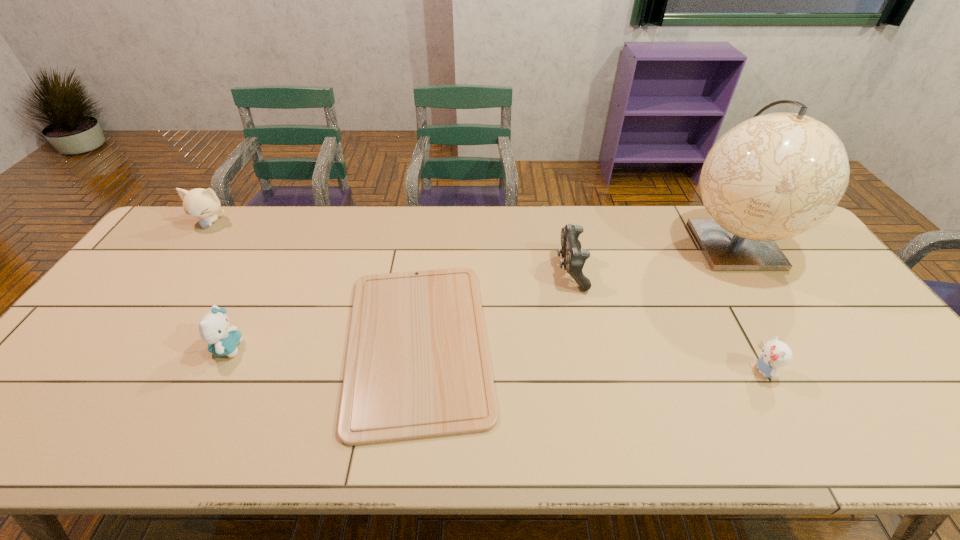
The width and height of the screenshot is (960, 540). Find the location of `kitten located at the far edge`. kitten located at the far edge is located at coordinates (200, 203).

Locate an element on the screen. control at the far edge is located at coordinates (574, 257).

Locate an element on the screen. Image resolution: width=960 pixels, height=540 pixels. object that is positioned at the near edge is located at coordinates (417, 366).

The image size is (960, 540). I want to click on object that is at the left edge, so click(x=200, y=203).

The width and height of the screenshot is (960, 540). What are the coordinates of `object located in the right edge section of the desktop` in the screenshot? It's located at (772, 177).

Find the location of a particular element. object that is at the far left corner is located at coordinates (200, 203).

Locate an element on the screen. object located in the far right corner section of the desktop is located at coordinates (772, 177).

Identify the location of vacant space at the far edge of the desktop. This screenshot has width=960, height=540. (524, 241).

Identify the location of vacant region at the near edge of the desktop. The image size is (960, 540). (x=329, y=429).

This screenshot has height=540, width=960. What are the coordinates of `free region at the left edge` in the screenshot? It's located at (143, 291).